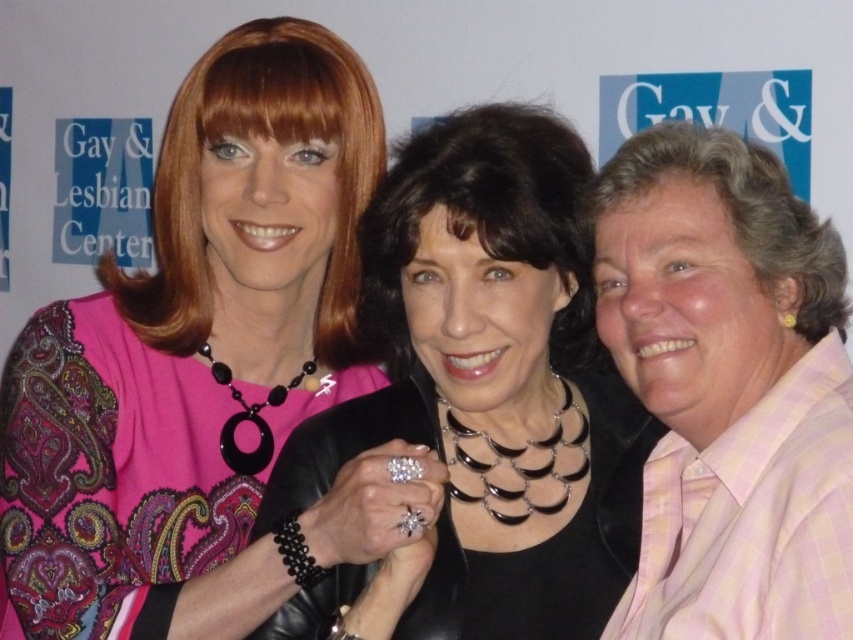
In the photo of the three people at the Gay and Lesbian Center event, where is the matte pink blouse at upper left in relation to the black leather jacket at center?

The matte pink blouse at upper left is to the left of the black leather jacket at center.

You are at a community event and need to find the person wearing a black leather jacket at center and the person wearing a pink checkered shirt at right. Based on their positions, which one is standing to the left?

The black leather jacket at center is positioned on the left side of pink checkered shirt at right, so the person wearing the black leather jacket at center is standing to the left.